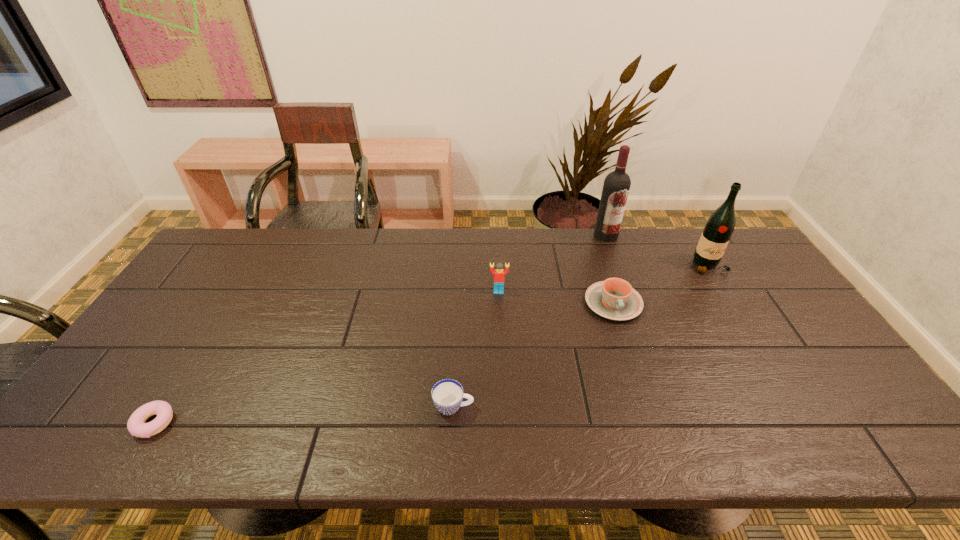
At what (x,y) coordinates should I click in order to perform the action: click on the left wine bottle. Please return your answer as a coordinate pair (x, y). The height and width of the screenshot is (540, 960). Looking at the image, I should click on (x=617, y=183).

Where is `the farther wine bottle`? The height and width of the screenshot is (540, 960). the farther wine bottle is located at coordinates (617, 183).

This screenshot has width=960, height=540. Find the location of `the rightmost object`. the rightmost object is located at coordinates (720, 225).

Identify the location of the fifth nearest object. The height and width of the screenshot is (540, 960). (720, 225).

Where is `the fourth object from right to left`? The width and height of the screenshot is (960, 540). the fourth object from right to left is located at coordinates (499, 272).

Locate an element on the screen. This screenshot has height=540, width=960. Lego is located at coordinates (499, 272).

I want to click on chinaware, so click(615, 299).

At what (x,y) coordinates should I click in order to perform the action: click on the fifth object from right to left. Please return your answer as a coordinate pair (x, y). Looking at the image, I should click on (447, 395).

Locate an element on the screen. This screenshot has width=960, height=540. doughnut is located at coordinates (136, 425).

You are a GUI agent. You are given a task and a screenshot of the screen. Output one action in this format:
    pyautogui.click(x=<x>, y=<y>)
    Task: Click on the leftmost object
    The image size is (960, 540).
    Given the screenshot: What is the action you would take?
    pyautogui.click(x=136, y=425)